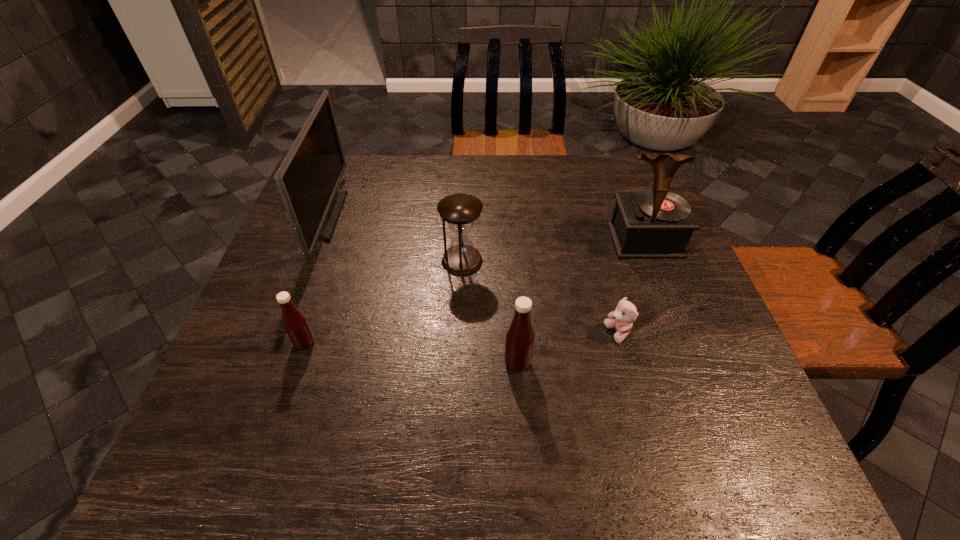
Find the location of a particular element. This screenshot has width=960, height=540. object located at the right edge is located at coordinates (658, 224).

Find the location of a particular element. This screenshot has height=540, width=960. object present at the far left corner is located at coordinates (308, 178).

Locate an element on the screen. This screenshot has height=540, width=960. blank space at the far edge is located at coordinates (555, 185).

Find the location of a particular element. Image resolution: width=960 pixels, height=540 pixels. vacant region at the near edge of the desktop is located at coordinates (310, 420).

Identify the location of vacant space at the left edge of the desktop. (345, 212).

Where is `vacant space at the right edge`? vacant space at the right edge is located at coordinates (708, 328).

The width and height of the screenshot is (960, 540). I want to click on free location at the far left corner of the desktop, so click(368, 159).

The width and height of the screenshot is (960, 540). In the image, there is a desktop. What are the coordinates of `free space at the far right corner` in the screenshot? It's located at (599, 189).

Image resolution: width=960 pixels, height=540 pixels. Find the location of `free space at the near right corner of the desktop`. free space at the near right corner of the desktop is located at coordinates (713, 403).

Where is `free space between the rightmost object and the fourth object from right to left`? The image size is (960, 540). free space between the rightmost object and the fourth object from right to left is located at coordinates (553, 251).